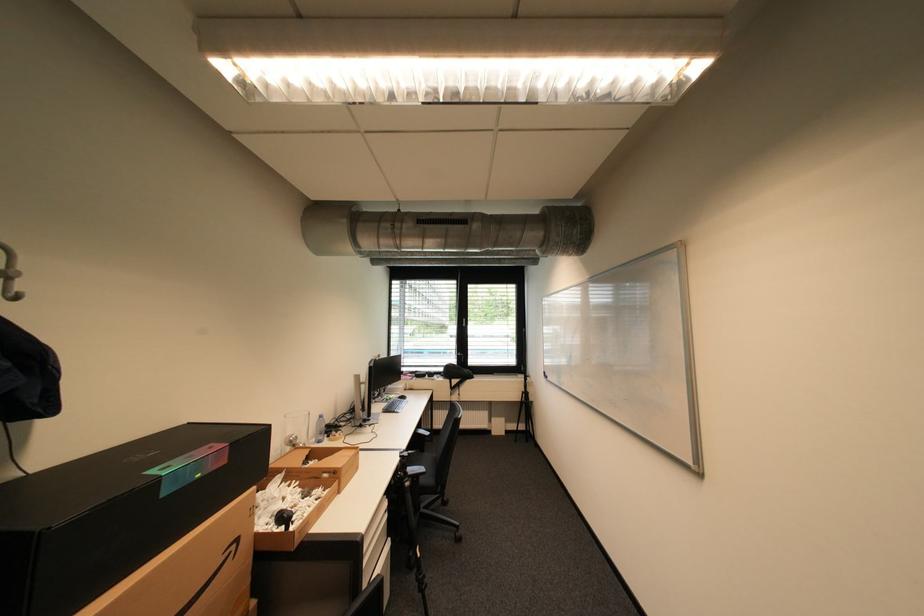
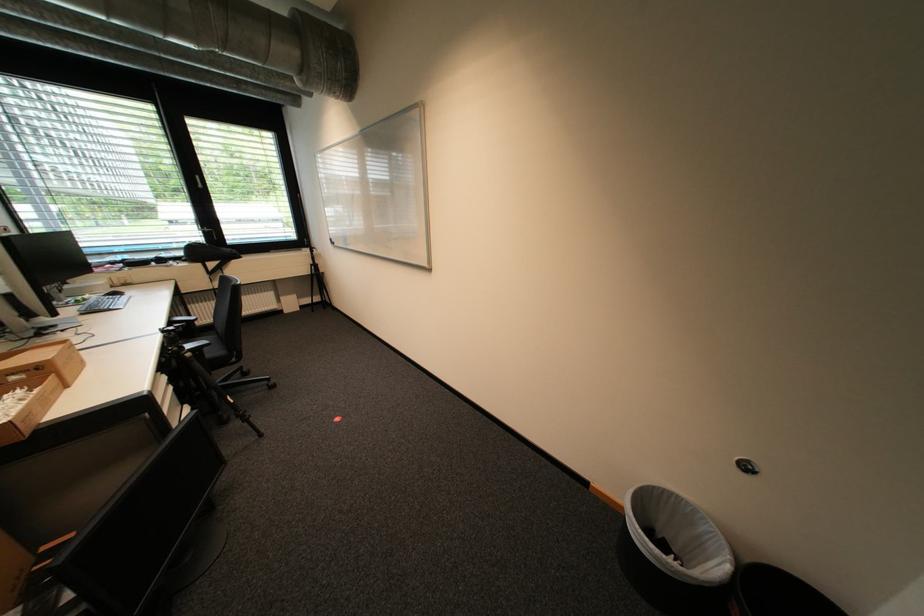
How did the camera likely rotate?

The camera's rotation is toward right-down.